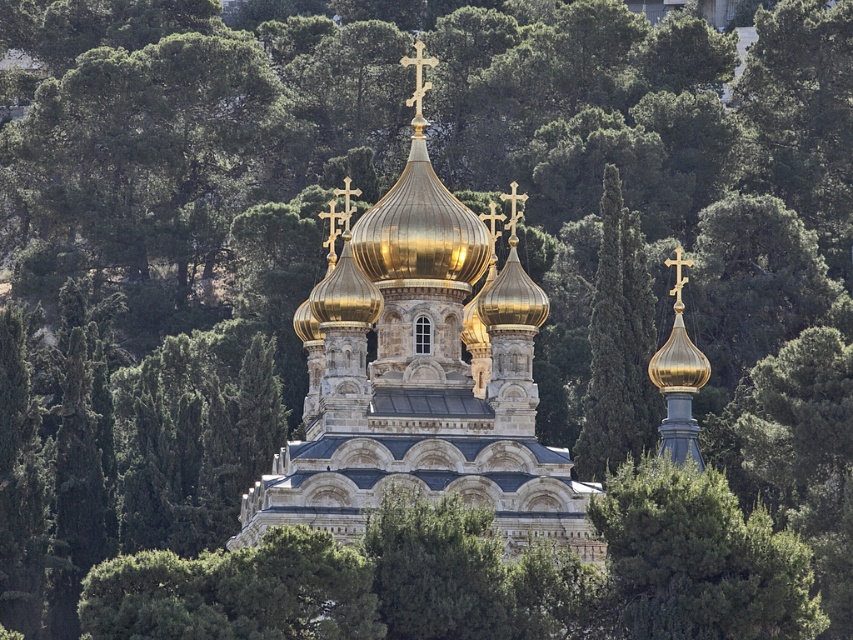
You are a photographer planning to take a wide shot of the gold stone church at center and the green leafy tree at center. Based on their sizes, which one should you focus on to ensure it fills the frame appropriately?

The gold stone church at center is wider than the green leafy tree at center, so focusing on it will ensure it fills the frame appropriately.

You are standing in front of the church with two points marked on the structure. The first point is at coordinate point (347,452) and the second is at point (650,465). Which point is closer to you?

Point (347,452) is closer to you because it is further to the camera than point (650,465).

You are standing at the point marked as point (421, 376) in the image. What structure is directly beneath you?

The point (421, 376) corresponds to the gold stone church at center, so the structure directly beneath you is the gold stone church at center.